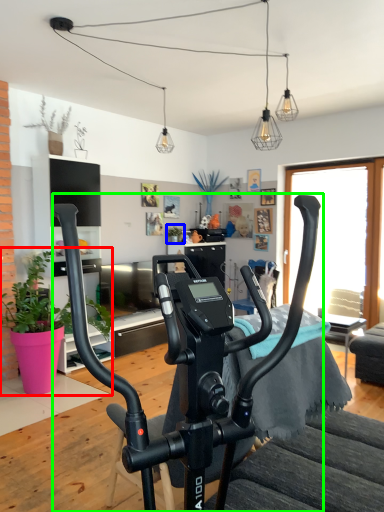
Question: Considering the real-world distances, which object is closest to houseplant (highlighted by a red box)? houseplant (highlighted by a blue box) or stationary bicycle (highlighted by a green box).

Choices:
 (A) houseplant
 (B) stationary bicycle

Answer: (A)